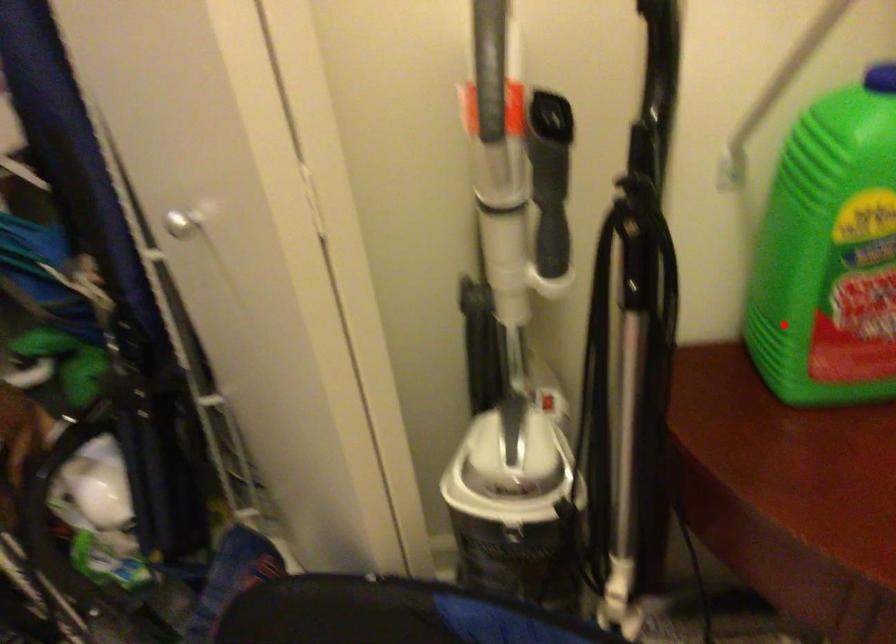
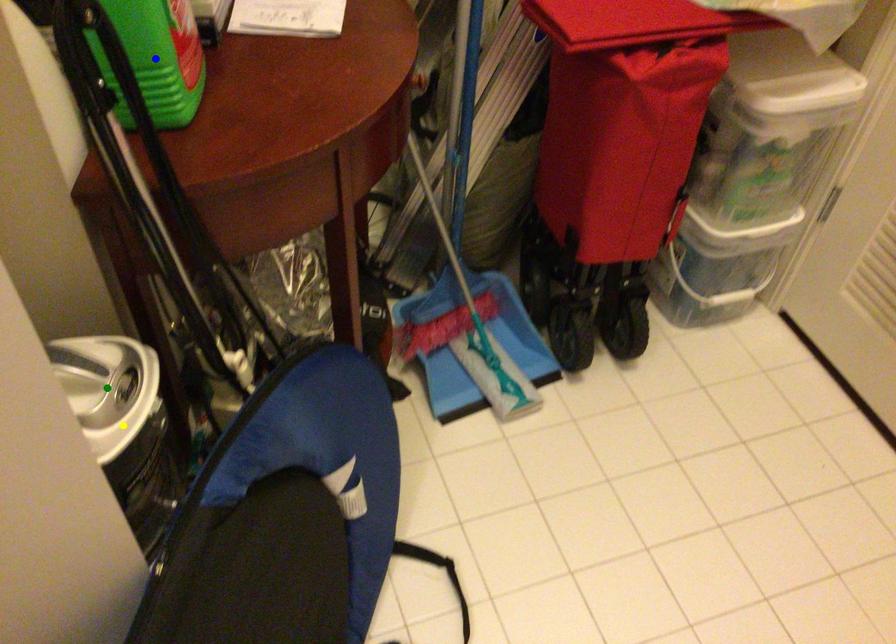
Question: I am providing you with two images of the same scene from different viewpoints. A red point is marked on the first image. You are given multiple points on the second image. Which mark in image 2 goes with the point in image 1?

Choices:
 (A) yellow point
 (B) blue point
 (C) green point

Answer: (B)